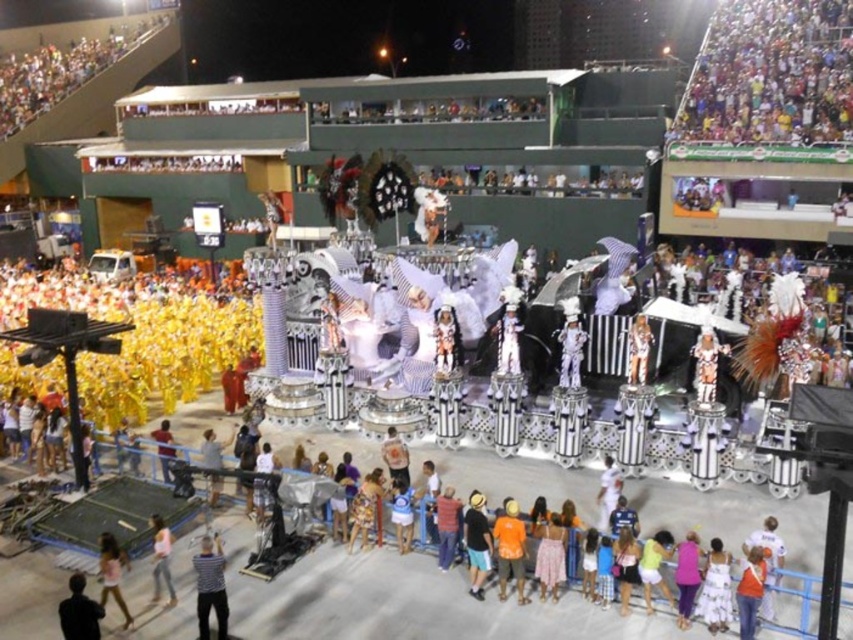
Can you confirm if black cotton shirt at center is taller than orange fabric person at center?

Indeed, black cotton shirt at center has a greater height compared to orange fabric person at center.

Between point (479, 508) and point (160, 449), which one is positioned in front?

Point (479, 508) is more forward.

You are a GUI agent. You are given a task and a screenshot of the screen. Output one action in this format:
    pyautogui.click(x=<x>, y=<y>)
    Task: Click on the black cotton shirt at center
    
    Given the screenshot: What is the action you would take?
    pyautogui.click(x=477, y=544)

Identify the location of black cotton shirt at center. (477, 544).

Which is below, striped polo shirt at center or black cotton shirt at center?

striped polo shirt at center is below.

Find the location of a particular element. The image size is (853, 640). striped polo shirt at center is located at coordinates (210, 586).

Does point (216, 618) come closer to viewer compared to point (480, 561)?

Yes, point (216, 618) is closer to viewer.

Find the location of `striped polo shirt at center`. striped polo shirt at center is located at coordinates (210, 586).

Between light pink fabric dress at lower left and orange fabric person at center, which one is positioned higher?

orange fabric person at center is higher up.

Image resolution: width=853 pixels, height=640 pixels. What do you see at coordinates (111, 573) in the screenshot?
I see `light pink fabric dress at lower left` at bounding box center [111, 573].

This screenshot has width=853, height=640. In order to click on light pink fabric dress at lower left in this screenshot , I will do `click(111, 573)`.